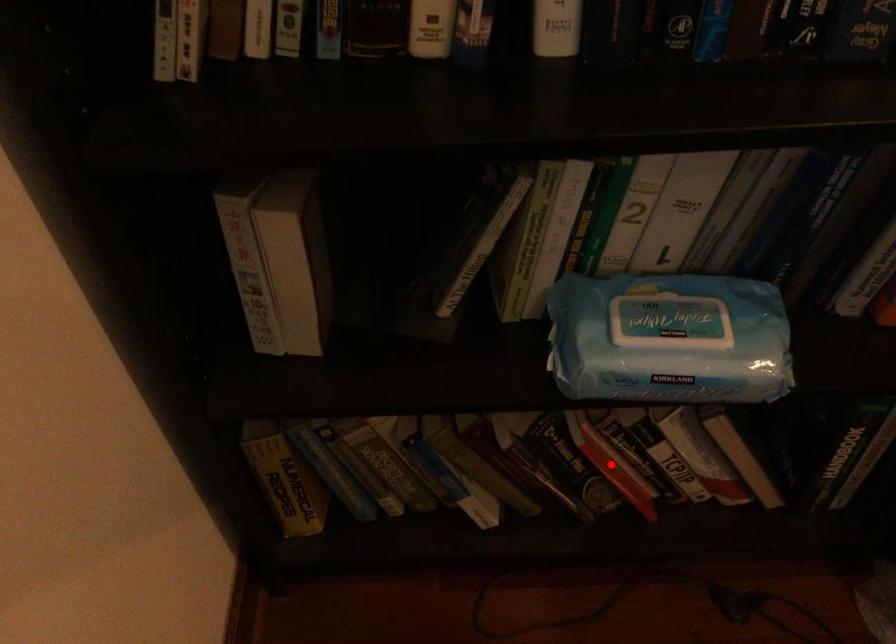
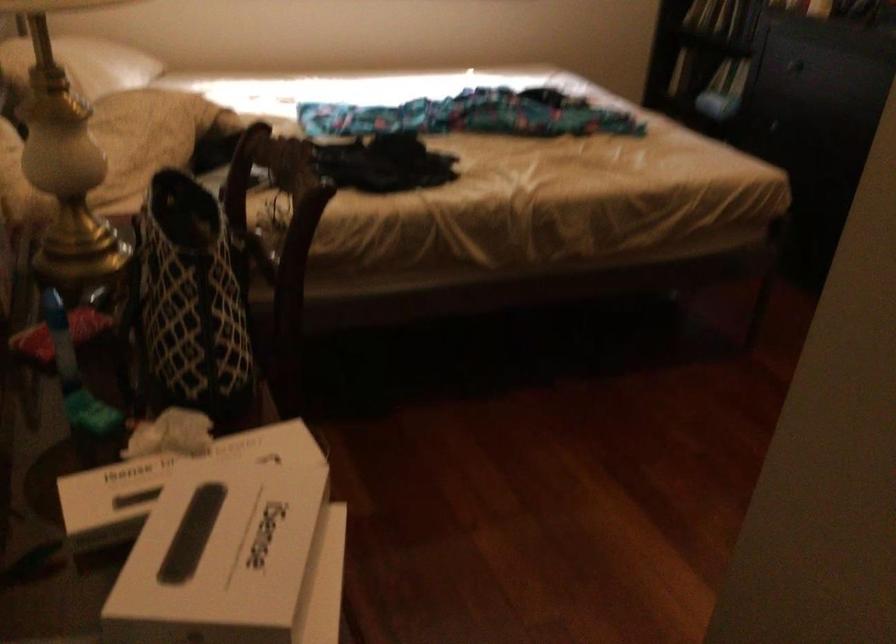
Question: I am providing you with two images of the same scene from different viewpoints. A red point is marked on the first image. Is the red point's position out of view in image 2?

Choices:
 (A) Yes
 (B) No

Answer: (A)